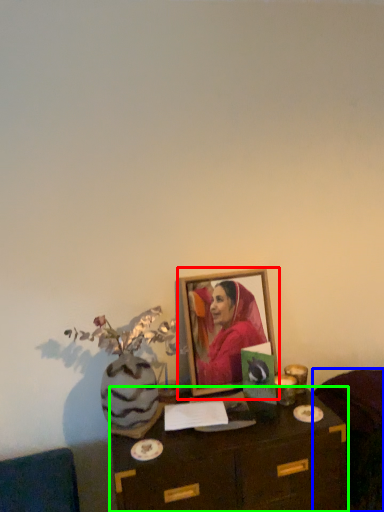
Question: Considering the real-world distances, which object is farthest from picture frame (highlighted by a red box)? furniture (highlighted by a blue box) or table (highlighted by a green box)?

Choices:
 (A) furniture
 (B) table

Answer: (A)